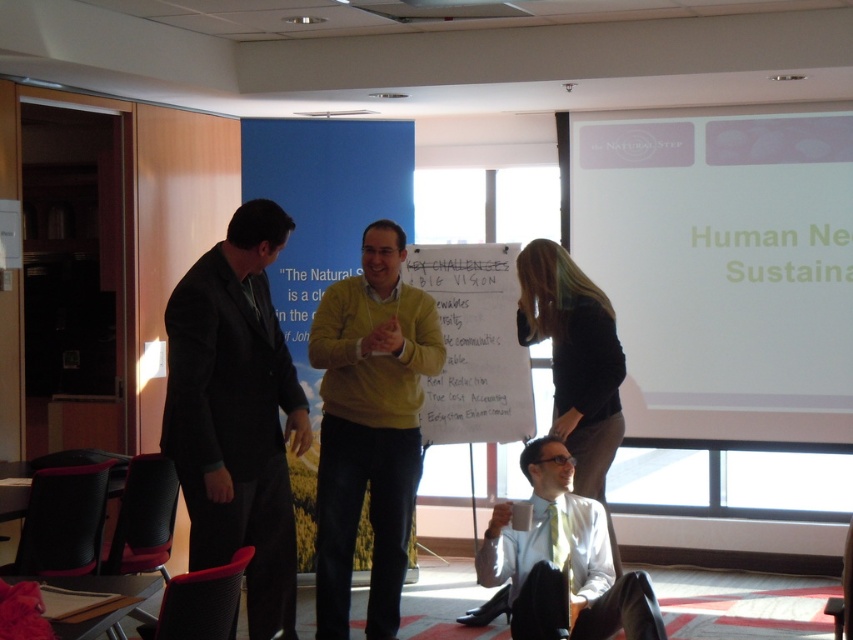
Question: Does matte yellow sweater at center appear over light brown leather jacket at lower center?

Choices:
 (A) yes
 (B) no

Answer: (B)

Question: Estimate the real-world distances between objects in this image. Which object is closer to the light brown leather jacket at lower center?

Choices:
 (A) white glossy mug at lower center
 (B) white matte projection screen at upper right
 (C) matte yellow sweater at center
 (D) black suit at left

Answer: (A)

Question: Can you confirm if black suit at left is positioned below light brown leather jacket at lower center?

Choices:
 (A) yes
 (B) no

Answer: (B)

Question: Which of the following is the farthest from the observer?

Choices:
 (A) white matte projection screen at upper right
 (B) light brown leather jacket at lower center
 (C) matte yellow sweater at center

Answer: (A)

Question: Is white matte projection screen at upper right to the right of black suit at left from the viewer's perspective?

Choices:
 (A) no
 (B) yes

Answer: (B)

Question: Which object is positioned farthest from the white glossy mug at lower center?

Choices:
 (A) black suit at left
 (B) light brown leather jacket at lower center
 (C) matte yellow sweater at center
 (D) white matte projection screen at upper right

Answer: (D)